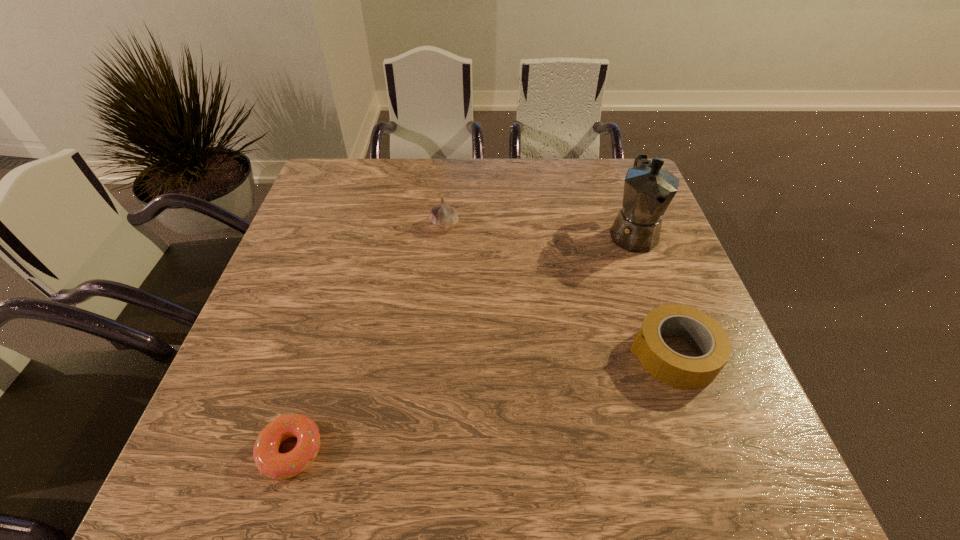
This screenshot has width=960, height=540. What are the coordinates of `coffeepot` in the screenshot? It's located at (649, 189).

What are the coordinates of `the third shortest object` in the screenshot? It's located at (443, 216).

At what (x,y) coordinates should I click in order to perform the action: click on garlic. Please return your answer as a coordinate pair (x, y). This screenshot has height=540, width=960. Looking at the image, I should click on (443, 216).

Where is `the second shortest object`? The width and height of the screenshot is (960, 540). the second shortest object is located at coordinates (679, 371).

You are a GUI agent. You are given a task and a screenshot of the screen. Output one action in this format:
    pyautogui.click(x=<x>, y=<y>)
    Task: Click on the duct tape
    
    Given the screenshot: What is the action you would take?
    pyautogui.click(x=679, y=371)

You are a GUI agent. You are given a task and a screenshot of the screen. Output one action in this format:
    pyautogui.click(x=<x>, y=<y>)
    Task: Click on the shortest object
    This screenshot has width=960, height=540.
    Given the screenshot: What is the action you would take?
    pyautogui.click(x=271, y=463)

Locate an element on the screen. The width and height of the screenshot is (960, 540). doughnut is located at coordinates (271, 463).

Locate an element on the screen. vacant space situated on the pouring side of the tallest object is located at coordinates (677, 353).

This screenshot has height=540, width=960. I want to click on vacant space located 0.380m on the right of the third object from right to left, so click(596, 225).

Find the location of a particular element. The height and width of the screenshot is (540, 960). vacant space positioned 0.150m at the edge of the third tallest object is located at coordinates (559, 354).